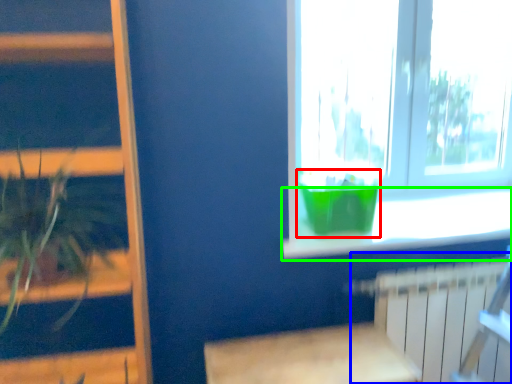
Question: Considering the real-world distances, which object is closest to glass vase (highlighted by a red box)? radiator (highlighted by a blue box) or window sill (highlighted by a green box).

Choices:
 (A) radiator
 (B) window sill

Answer: (B)